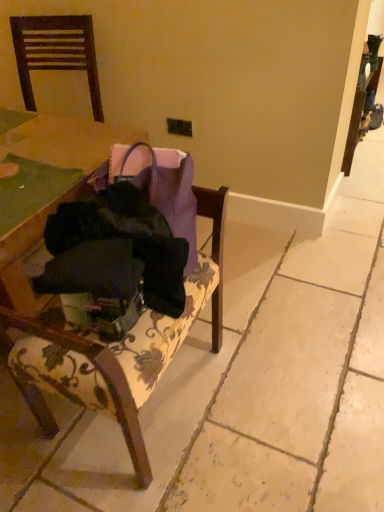
Find the location of `free space underneath velvet floral-patterned chair at center, acting as the 2th chair starting from the left (from a real-world perspective)`. free space underneath velvet floral-patterned chair at center, acting as the 2th chair starting from the left (from a real-world perspective) is located at coordinates (149, 404).